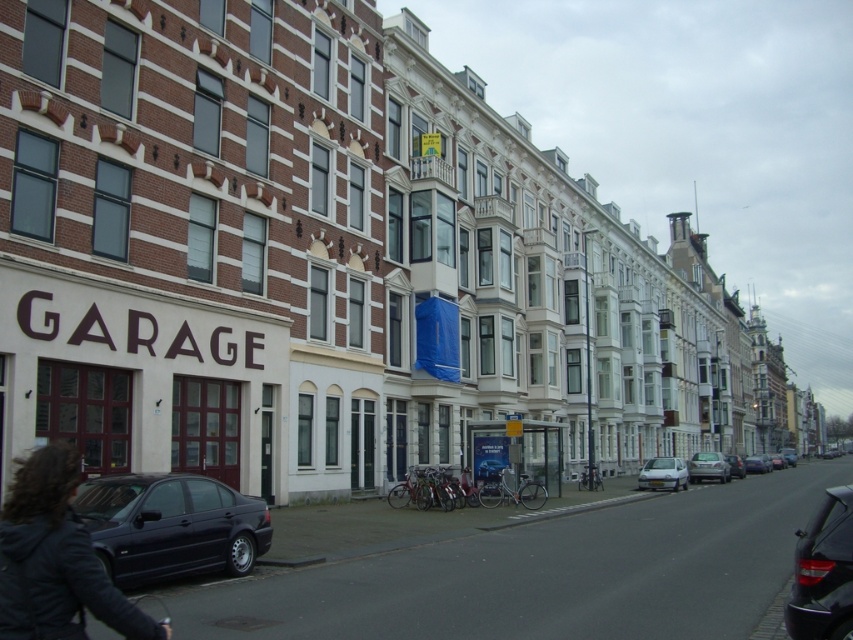
Who is positioned more to the right, black leather jacket at lower left or shiny black car at right?

shiny black car at right

Is black leather jacket at lower left thinner than shiny black car at right?

Yes, black leather jacket at lower left is thinner than shiny black car at right.

This screenshot has height=640, width=853. Find the location of `black leather jacket at lower left`. black leather jacket at lower left is located at coordinates (55, 557).

Does shiny black car at right have a larger size compared to metallic silver sedan at right?

No.

Does shiny black car at right have a greater width compared to metallic silver sedan at right?

No, shiny black car at right is not wider than metallic silver sedan at right.

In order to click on shiny black car at right in this screenshot , I will do `click(822, 570)`.

From the picture: Between silver metallic hatchback at center-right and metallic silver sedan at center-right, which one appears on the left side from the viewer's perspective?

silver metallic hatchback at center-right is more to the left.

Does silver metallic hatchback at center-right have a greater width compared to metallic silver sedan at center-right?

Incorrect, silver metallic hatchback at center-right's width does not surpass metallic silver sedan at center-right's.

Is point (663, 480) in front of point (735, 474)?

Yes, it is.

At what (x,y) coordinates should I click in order to perform the action: click on silver metallic hatchback at center-right. Please return your answer as a coordinate pair (x, y). Image resolution: width=853 pixels, height=640 pixels. Looking at the image, I should click on (663, 474).